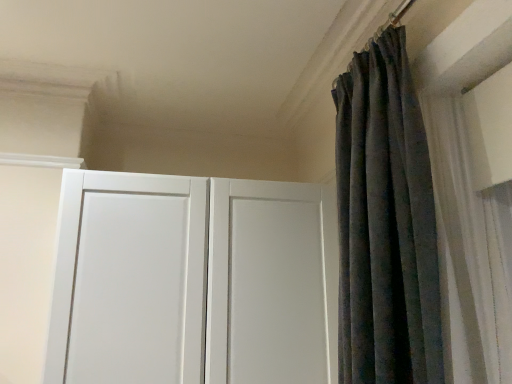
Where is `dark gray velvet curtain at upper right`? The image size is (512, 384). dark gray velvet curtain at upper right is located at coordinates (385, 223).

Describe the element at coordinates (385, 223) in the screenshot. The height and width of the screenshot is (384, 512). I see `dark gray velvet curtain at upper right` at that location.

This screenshot has height=384, width=512. In order to click on dark gray velvet curtain at upper right in this screenshot , I will do `click(385, 223)`.